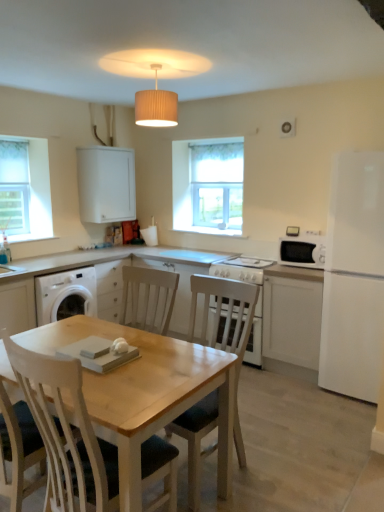
Question: From the image's perspective, does white matte cabinet at right, positioned as the 1th cabinetry in right-to-left order, appear lower than light wood chair at center?

Choices:
 (A) yes
 (B) no

Answer: (B)

Question: From a real-world perspective, is white matte cabinet at right, positioned as the second cabinetry in left-to-right order, on top of light wood chair at center?

Choices:
 (A) yes
 (B) no

Answer: (B)

Question: Can you confirm if white matte cabinet at right, positioned as the 1th cabinetry in right-to-left order, is taller than light wood chair at center?

Choices:
 (A) yes
 (B) no

Answer: (B)

Question: Is white matte cabinet at right, which is the second cabinetry from top to bottom, positioned far away from light wood chair at center?

Choices:
 (A) yes
 (B) no

Answer: (B)

Question: Does white matte cabinet at right, positioned as the 1th cabinetry in right-to-left order, contain light wood chair at center?

Choices:
 (A) yes
 (B) no

Answer: (B)

Question: Would you say white matte refrigerator at right is inside or outside white fabric window screen at left?

Choices:
 (A) outside
 (B) inside

Answer: (A)

Question: From a real-world perspective, is white matte refrigerator at right positioned above or below white fabric window screen at left?

Choices:
 (A) above
 (B) below

Answer: (B)

Question: Is white matte refrigerator at right to the left or to the right of white fabric window screen at left in the image?

Choices:
 (A) left
 (B) right

Answer: (B)

Question: Is white matte refrigerator at right in front of or behind white fabric window screen at left in the image?

Choices:
 (A) front
 (B) behind

Answer: (A)

Question: From the image's perspective, is light wood chair at center above or below white glossy microwave oven at right?

Choices:
 (A) above
 (B) below

Answer: (B)

Question: From their relative heights in the image, would you say light wood chair at center is taller or shorter than white glossy microwave oven at right?

Choices:
 (A) tall
 (B) short

Answer: (A)

Question: Is light wood chair at center wider or thinner than white glossy microwave oven at right?

Choices:
 (A) thin
 (B) wide

Answer: (B)

Question: Is point (203, 335) closer or farther from the camera than point (304, 239)?

Choices:
 (A) closer
 (B) farther

Answer: (A)

Question: In terms of height, does white matte cabinet at right, marked as the 2th cabinetry in a back-to-front arrangement, look taller or shorter compared to white glass window at center?

Choices:
 (A) short
 (B) tall

Answer: (A)

Question: Considering the relative positions of white matte cabinet at right, positioned as the 1th cabinetry in right-to-left order, and white glass window at center in the image provided, is white matte cabinet at right, positioned as the 1th cabinetry in right-to-left order, to the left or to the right of white glass window at center?

Choices:
 (A) left
 (B) right

Answer: (B)